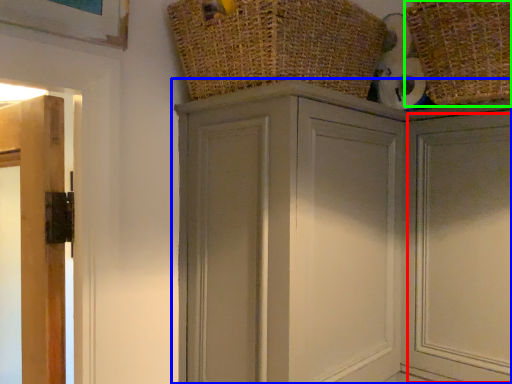
Question: Which is farther away from door (highlighted by a red box)? cupboard (highlighted by a blue box) or basket (highlighted by a green box)?

Choices:
 (A) cupboard
 (B) basket

Answer: (B)